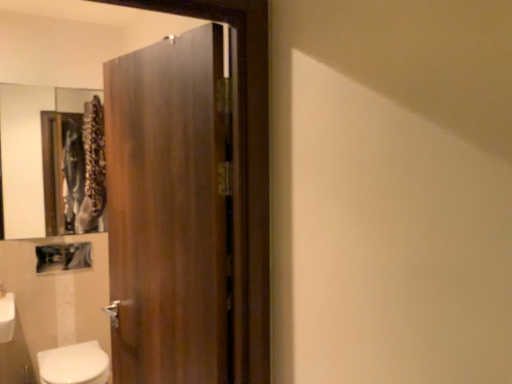
Question: Is white glossy bidet at lower left a part of wooden door at center?

Choices:
 (A) no
 (B) yes

Answer: (A)

Question: Considering the relative sizes of wooden door at center and white glossy bidet at lower left in the image provided, is wooden door at center bigger than white glossy bidet at lower left?

Choices:
 (A) no
 (B) yes

Answer: (B)

Question: From a real-world perspective, is wooden door at center physically below white glossy bidet at lower left?

Choices:
 (A) yes
 (B) no

Answer: (B)

Question: Is wooden door at center touching white glossy bidet at lower left?

Choices:
 (A) no
 (B) yes

Answer: (A)

Question: Can you confirm if wooden door at center is thinner than white glossy bidet at lower left?

Choices:
 (A) yes
 (B) no

Answer: (A)

Question: Considering their positions, is wooden frame mirror at upper left located in front of or behind wooden door at center?

Choices:
 (A) front
 (B) behind

Answer: (B)

Question: From the image's perspective, is wooden frame mirror at upper left located above or below wooden door at center?

Choices:
 (A) below
 (B) above

Answer: (B)

Question: From a real-world perspective, is wooden frame mirror at upper left above or below wooden door at center?

Choices:
 (A) below
 (B) above

Answer: (B)

Question: Considering the positions of wooden frame mirror at upper left and wooden door at center in the image, is wooden frame mirror at upper left taller or shorter than wooden door at center?

Choices:
 (A) short
 (B) tall

Answer: (A)

Question: In the image, is wooden door at center on the left side or the right side of wooden frame mirror at upper left?

Choices:
 (A) left
 (B) right

Answer: (B)

Question: From the image's perspective, is wooden door at center located above or below wooden frame mirror at upper left?

Choices:
 (A) above
 (B) below

Answer: (B)

Question: Is point (147, 269) closer or farther from the camera than point (33, 157)?

Choices:
 (A) closer
 (B) farther

Answer: (A)

Question: Is wooden door at center wider or thinner than wooden frame mirror at upper left?

Choices:
 (A) thin
 (B) wide

Answer: (B)

Question: In terms of width, does white glossy bidet at lower left look wider or thinner when compared to wooden frame mirror at upper left?

Choices:
 (A) wide
 (B) thin

Answer: (A)

Question: Is point (91, 375) closer or farther from the camera than point (28, 96)?

Choices:
 (A) farther
 (B) closer

Answer: (B)